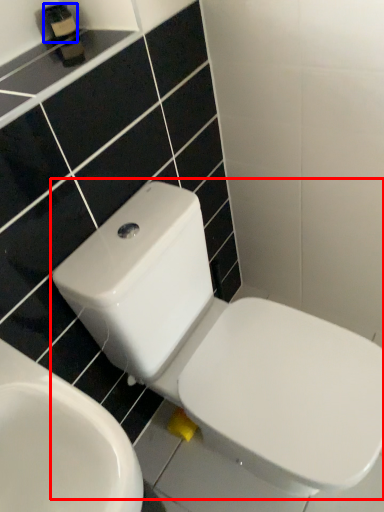
Question: Which object appears closest to the camera in this image, toilet (highlighted by a red box) or toiletry (highlighted by a blue box)?

Choices:
 (A) toilet
 (B) toiletry

Answer: (A)